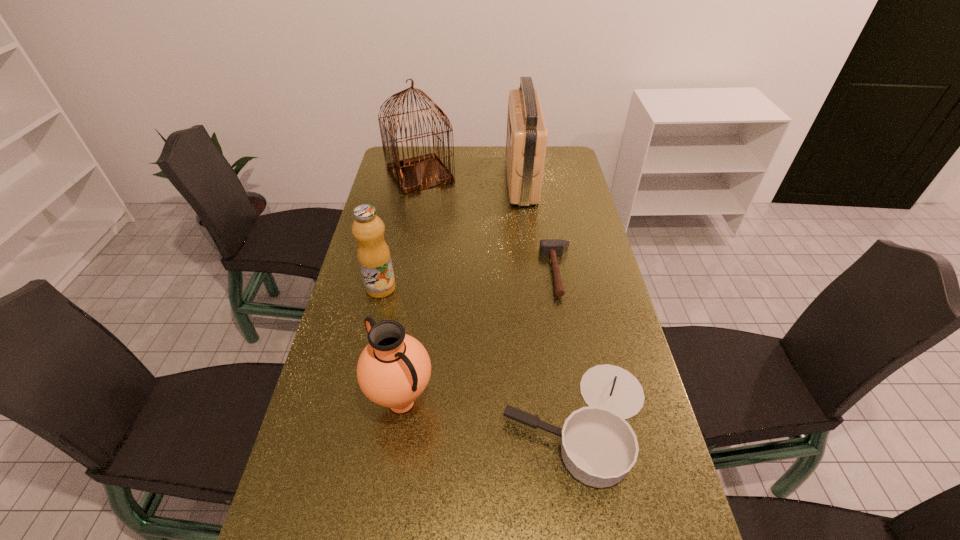
At what (x,y) coordinates should I click in order to perform the action: click on pitcher that is at the left edge. Please return your answer as a coordinate pair (x, y). Looking at the image, I should click on (393, 370).

Locate an element on the screen. saucepan present at the right edge is located at coordinates (598, 447).

Locate an element on the screen. hammer located at the right edge is located at coordinates (548, 247).

Image resolution: width=960 pixels, height=540 pixels. I want to click on object that is at the far left corner, so click(x=413, y=174).

The image size is (960, 540). I want to click on free space at the far edge of the desktop, so click(x=460, y=164).

The height and width of the screenshot is (540, 960). What are the coordinates of `vacant space at the left edge of the desktop` in the screenshot? It's located at (317, 515).

Locate an element on the screen. The image size is (960, 540). free space at the right edge is located at coordinates (546, 206).

Locate an element on the screen. The image size is (960, 540). free spot between the saucepan and the fruit juice is located at coordinates (479, 355).

This screenshot has height=540, width=960. In order to click on free space between the pitcher and the shortest object in this screenshot , I will do `click(480, 337)`.

Where is `free point between the saucepan and the fruit juice`? free point between the saucepan and the fruit juice is located at coordinates (479, 355).